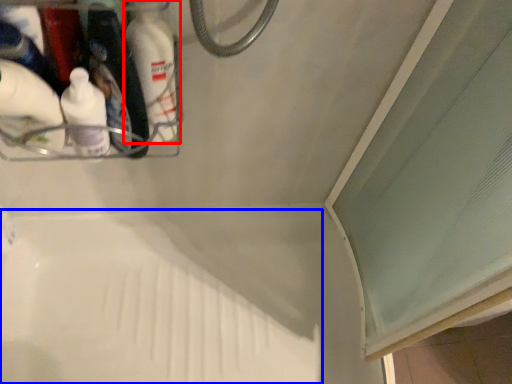
Question: Which of the following is the farthest to the observer, bottle (highlighted by a red box) or bath (highlighted by a blue box)?

Choices:
 (A) bottle
 (B) bath

Answer: (B)